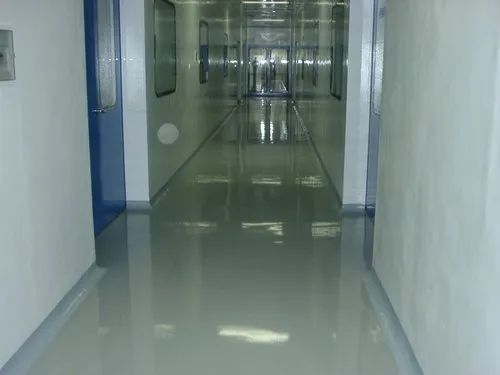
You are a GUI agent. You are given a task and a screenshot of the screen. Output one action in this format:
    pyautogui.click(x=<x>, y=<y>)
    Task: Click on the hallway
    Image resolution: width=500 pixels, height=375 pixels.
    Given the screenshot: What is the action you would take?
    pyautogui.click(x=250, y=103)